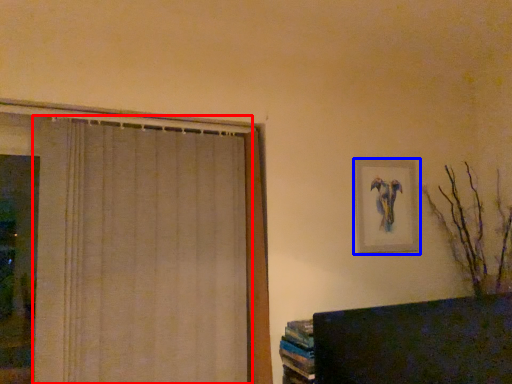
Question: Which of the following is the farthest to the observer, curtain (highlighted by a red box) or picture frame (highlighted by a blue box)?

Choices:
 (A) curtain
 (B) picture frame

Answer: (B)